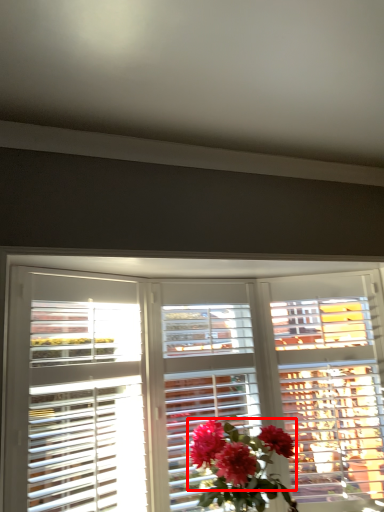
Question: Where is flower (annotated by the red box) located in relation to window in the image?

Choices:
 (A) right
 (B) left

Answer: (A)